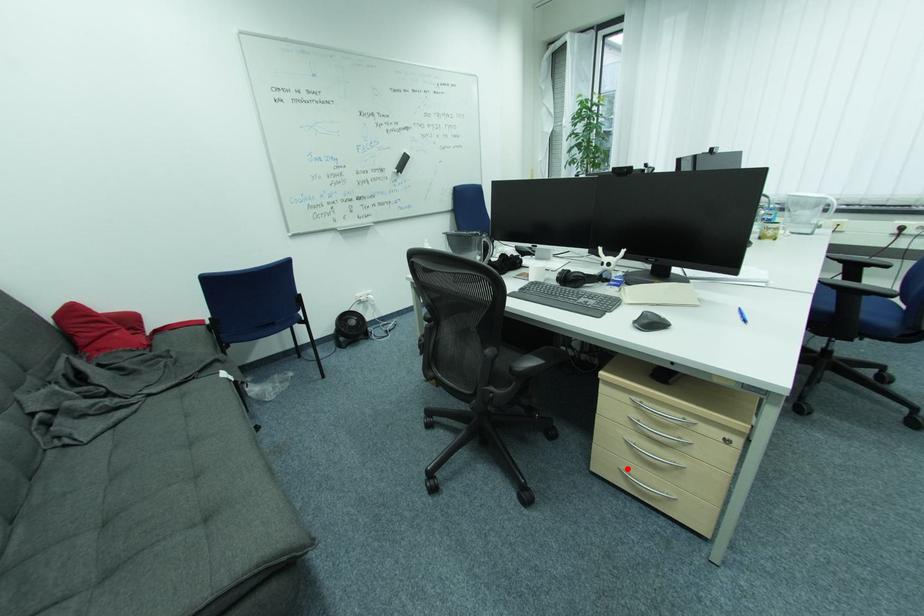
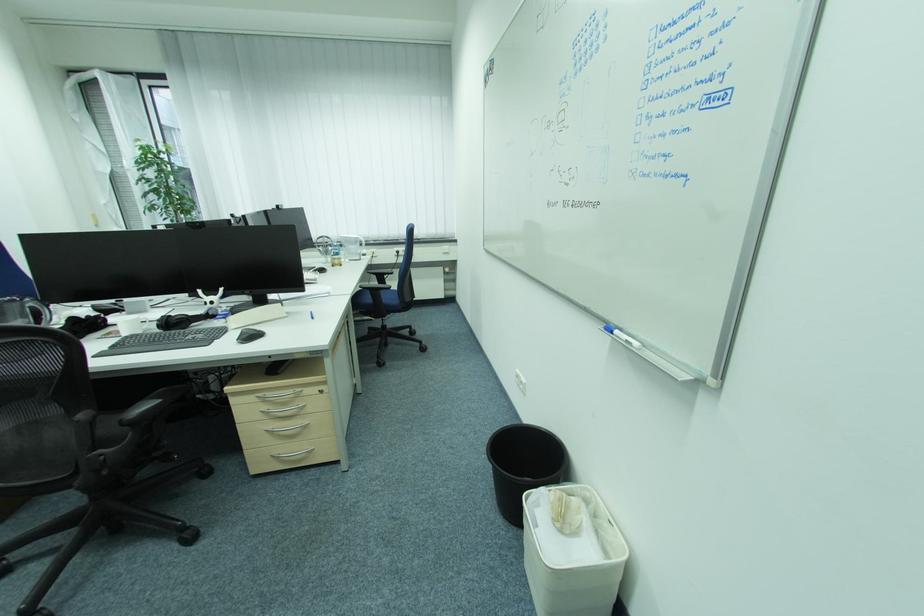
The point at the highlighted location is marked in the first image. Where is the corresponding point in the second image?

(278, 455)